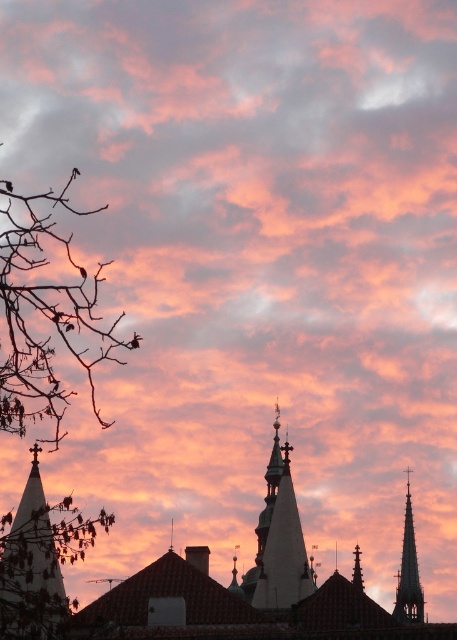
Question: Is white steeple at left positioned in front of smooth gray spire at upper right?

Choices:
 (A) no
 (B) yes

Answer: (B)

Question: Considering the relative positions of smooth glass spire at upper right and smooth gray spire at upper right in the image provided, where is smooth glass spire at upper right located with respect to smooth gray spire at upper right?

Choices:
 (A) right
 (B) left

Answer: (A)

Question: Which of the following is the farthest from the observer?

Choices:
 (A) (409, 476)
 (B) (40, 314)
 (C) (299, 588)
 (D) (356, 545)

Answer: (A)

Question: Which point appears farthest from the camera in this image?

Choices:
 (A) (86, 348)
 (B) (356, 564)
 (C) (274, 541)
 (D) (15, 634)

Answer: (A)

Question: Which object appears farthest from the camera in this image?

Choices:
 (A) smooth gray spire at upper right
 (B) smooth glass spire at upper right
 (C) white stone spire at center
 (D) white steeple at left

Answer: (B)

Question: Does bare branches at left appear under white steeple at left?

Choices:
 (A) yes
 (B) no

Answer: (B)